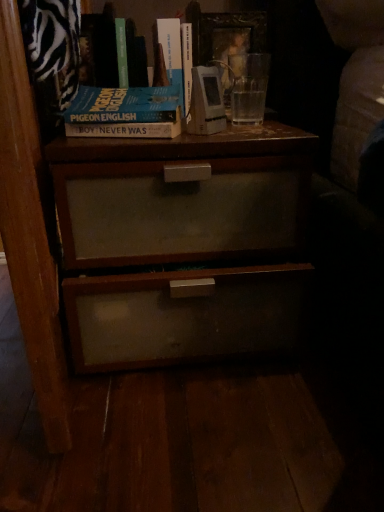
What do you see at coordinates (171, 51) in the screenshot? I see `hardcover book at upper center, arranged as the 1th book when viewed from the left` at bounding box center [171, 51].

Measure the distance between point (182, 31) and camera.

They are 89.50 centimeters apart.

The width and height of the screenshot is (384, 512). What do you see at coordinates (183, 245) in the screenshot?
I see `matte wood nightstand at center` at bounding box center [183, 245].

In order to click on blue matte book at upper center in this screenshot , I will do `click(123, 105)`.

Are hardcover book at upper center, the second book when ordered from right to left, and matte wood nightstand at center making contact?

They are not placed beside each other.

From the picture: Is matte wood nightstand at center a part of hardcover book at upper center, the second book when ordered from right to left?

That's incorrect, matte wood nightstand at center is not inside hardcover book at upper center, the second book when ordered from right to left.

Does hardcover book at upper center, arranged as the 1th book when viewed from the left, have a greater width compared to matte wood nightstand at center?

No, hardcover book at upper center, arranged as the 1th book when viewed from the left, is not wider than matte wood nightstand at center.

Is point (171, 56) in front of point (171, 154)?

No, it is not.

Consider the image. Are hardcover book at upper center, the 2th book viewed from the left, and hardcover book at upper center, the second book when ordered from right to left, beside each other?

Yes, hardcover book at upper center, the 2th book viewed from the left, is beside hardcover book at upper center, the second book when ordered from right to left.

Which point is more forward, (189, 48) or (171, 79)?

The point (171, 79) is more forward.

Is hardcover book at upper center, the 2th book viewed from the left, taller than hardcover book at upper center, the second book when ordered from right to left?

Incorrect, the height of hardcover book at upper center, the 2th book viewed from the left, is not larger of that of hardcover book at upper center, the second book when ordered from right to left.

At what (x,y) coordinates should I click in order to perform the action: click on book that is under the hardcover book at upper center, the second book when ordered from right to left (from a real-world perspective). Please return your answer as a coordinate pair (x, y). Looking at the image, I should click on (187, 66).

Is matte wood nightstand at center completely or partially outside of hardcover book at upper center, marked as the first book in a right-to-left arrangement?

Yes, matte wood nightstand at center is located beyond the bounds of hardcover book at upper center, marked as the first book in a right-to-left arrangement.

Where is `the 2nd book behind the matte wood nightstand at center`? The image size is (384, 512). the 2nd book behind the matte wood nightstand at center is located at coordinates (187, 66).

Considering the relative sizes of matte wood nightstand at center and hardcover book at upper center, marked as the first book in a right-to-left arrangement, in the image provided, is matte wood nightstand at center wider than hardcover book at upper center, marked as the first book in a right-to-left arrangement,?

Yes, matte wood nightstand at center is wider than hardcover book at upper center, marked as the first book in a right-to-left arrangement.

From a real-world perspective, which is physically below, hardcover book at upper center, the second book when ordered from right to left, or hardcover book at upper center, marked as the first book in a right-to-left arrangement?

In real-world perspective, hardcover book at upper center, marked as the first book in a right-to-left arrangement, is lower.

Is hardcover book at upper center, arranged as the 1th book when viewed from the left, to the right of hardcover book at upper center, the 2th book viewed from the left, from the viewer's perspective?

Incorrect, hardcover book at upper center, arranged as the 1th book when viewed from the left, is not on the right side of hardcover book at upper center, the 2th book viewed from the left.

Considering the positions of points (178, 58) and (189, 27), is point (178, 58) closer to camera compared to point (189, 27)?

Yes.

From a real-world perspective, is blue matte book at upper center physically located above or below matte wood nightstand at center?

From a real-world perspective, blue matte book at upper center is physically above matte wood nightstand at center.

Locate an element on the screen. paperback book above the matte wood nightstand at center (from a real-world perspective) is located at coordinates (123, 105).

Is blue matte book at upper center turned away from matte wood nightstand at center?

No.

Are blue matte book at upper center and matte wood nightstand at center making contact?

They are not placed beside each other.

Between point (184, 29) and point (173, 94), which one is positioned in front?

The point (173, 94) is in front.

From a real-world perspective, which is physically above, hardcover book at upper center, marked as the first book in a right-to-left arrangement, or blue matte book at upper center?

hardcover book at upper center, marked as the first book in a right-to-left arrangement.

Considering the relative positions of hardcover book at upper center, the 2th book viewed from the left, and blue matte book at upper center in the image provided, is hardcover book at upper center, the 2th book viewed from the left, to the left or to the right of blue matte book at upper center?

Based on their positions, hardcover book at upper center, the 2th book viewed from the left, is located to the right of blue matte book at upper center.

Does hardcover book at upper center, the 2th book viewed from the left, have a lesser width compared to blue matte book at upper center?

In fact, hardcover book at upper center, the 2th book viewed from the left, might be wider than blue matte book at upper center.

From the image's perspective, is matte wood nightstand at center on blue matte book at upper center?

No.

Is matte wood nightstand at center directly adjacent to blue matte book at upper center?

No, matte wood nightstand at center is not next to blue matte book at upper center.

Is matte wood nightstand at center facing towards blue matte book at upper center?

No.

This screenshot has width=384, height=512. In order to click on nightstand that appears below the hardcover book at upper center, arranged as the 1th book when viewed from the left (from a real-world perspective) in this screenshot , I will do `click(183, 245)`.

You are a GUI agent. You are given a task and a screenshot of the screen. Output one action in this format:
    pyautogui.click(x=<x>, y=<y>)
    Task: Click on the book that appears above the hardcover book at upper center, the 2th book viewed from the left (from a real-world perspective)
    
    Given the screenshot: What is the action you would take?
    pyautogui.click(x=171, y=51)

From the image, which object appears to be farther from matte wood nightstand at center, blue matte book at upper center or hardcover book at upper center, marked as the first book in a right-to-left arrangement?

Based on the image, hardcover book at upper center, marked as the first book in a right-to-left arrangement, appears to be further to matte wood nightstand at center.

Estimate the real-world distances between objects in this image. Which object is further from matte wood nightstand at center, hardcover book at upper center, the second book when ordered from right to left, or hardcover book at upper center, the 2th book viewed from the left?

hardcover book at upper center, the second book when ordered from right to left, lies further to matte wood nightstand at center than the other object.

Looking at the image, which one is located further to matte wood nightstand at center, blue matte book at upper center or hardcover book at upper center, arranged as the 1th book when viewed from the left?

hardcover book at upper center, arranged as the 1th book when viewed from the left, lies further to matte wood nightstand at center than the other object.

When comparing their distances from hardcover book at upper center, the second book when ordered from right to left, does matte wood nightstand at center or blue matte book at upper center seem closer?

blue matte book at upper center lies closer to hardcover book at upper center, the second book when ordered from right to left, than the other object.

Looking at the image, which one is located further to matte wood nightstand at center, hardcover book at upper center, the second book when ordered from right to left, or blue matte book at upper center?

The object further to matte wood nightstand at center is hardcover book at upper center, the second book when ordered from right to left.

Based on their spatial positions, is hardcover book at upper center, marked as the first book in a right-to-left arrangement, or hardcover book at upper center, the second book when ordered from right to left, further from blue matte book at upper center?

hardcover book at upper center, the second book when ordered from right to left.

From the image, which object appears to be nearer to matte wood nightstand at center, hardcover book at upper center, marked as the first book in a right-to-left arrangement, or hardcover book at upper center, arranged as the 1th book when viewed from the left?

The object closer to matte wood nightstand at center is hardcover book at upper center, marked as the first book in a right-to-left arrangement.

Based on their spatial positions, is hardcover book at upper center, the second book when ordered from right to left, or blue matte book at upper center further from hardcover book at upper center, marked as the first book in a right-to-left arrangement?

blue matte book at upper center lies further to hardcover book at upper center, marked as the first book in a right-to-left arrangement, than the other object.

In order to click on book between hardcover book at upper center, marked as the first book in a right-to-left arrangement, and blue matte book at upper center from top to bottom in this screenshot , I will do `click(171, 51)`.

Where is `paperback book between hardcover book at upper center, marked as the first book in a right-to-left arrangement, and matte wood nightstand at center from top to bottom`? The image size is (384, 512). paperback book between hardcover book at upper center, marked as the first book in a right-to-left arrangement, and matte wood nightstand at center from top to bottom is located at coordinates (123, 105).

Find the location of a particular element. This screenshot has height=512, width=384. paperback book between hardcover book at upper center, arranged as the 1th book when viewed from the left, and matte wood nightstand at center, in the vertical direction is located at coordinates (123, 105).

Where is `book that lies between hardcover book at upper center, the 2th book viewed from the left, and matte wood nightstand at center from top to bottom`? This screenshot has height=512, width=384. book that lies between hardcover book at upper center, the 2th book viewed from the left, and matte wood nightstand at center from top to bottom is located at coordinates (171, 51).